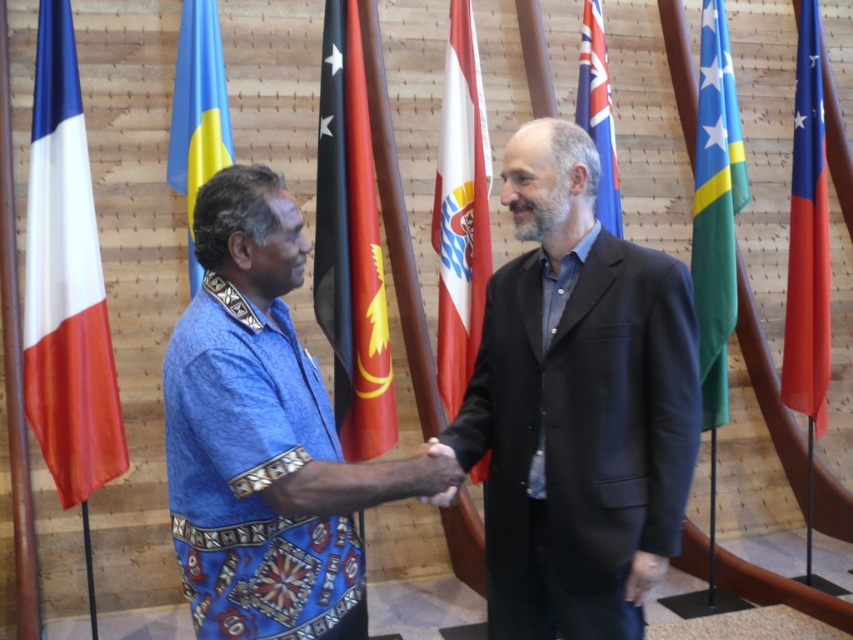
You are standing in the formal setting where two people are shaking hands. You need to place a small pin exactly at the coordinates point (577, 404). Which part of the image should you place it on?

The point (577, 404) is located on the dark blue suit at center, so you should place the pin on the dark blue suit at center.

You are an event planner setting up a photo shoot for a diplomatic event. You need to position two individuals for a handshake photo. The scene requires them to stand at least 3 meters apart for the camera angle. Given the current distance between the green fabric flag at right and the other flags, can they maintain the required distance while still being in frame?

The individuals are currently 3.61 meters apart, which exceeds the minimum requirement of 3 meters. Therefore, they can maintain the required distance while staying in frame for the photo shoot.

You are an event planner arranging a photo shoot for an international summit. You need to ensure that the green fabric flag at right and the blue fabric flag at left are visible in the background. Based on their positions, which flag will appear lower in the photo?

The green fabric flag at right is positioned under the blue fabric flag at left, so it will appear lower in the photo.